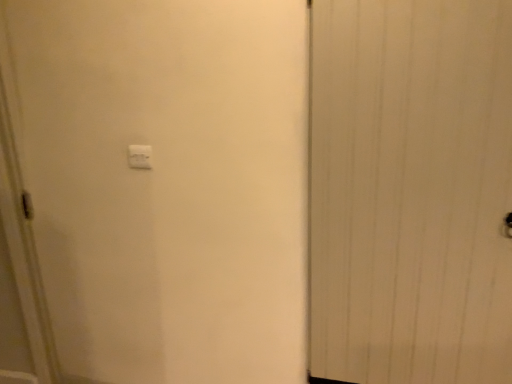
Question: Considering the positions of white plastic light switch at upper center and white wood door at right in the image, is white plastic light switch at upper center taller or shorter than white wood door at right?

Choices:
 (A) tall
 (B) short

Answer: (B)

Question: From the image's perspective, is white plastic light switch at upper center positioned above or below white wood door at right?

Choices:
 (A) below
 (B) above

Answer: (B)

Question: Considering the positions of white plastic light switch at upper center and white wood door at right in the image, is white plastic light switch at upper center bigger or smaller than white wood door at right?

Choices:
 (A) small
 (B) big

Answer: (A)

Question: Considering the positions of white wood door at right and white plastic light switch at upper center in the image, is white wood door at right wider or thinner than white plastic light switch at upper center?

Choices:
 (A) thin
 (B) wide

Answer: (B)

Question: Is white wood door at right taller or shorter than white plastic light switch at upper center?

Choices:
 (A) short
 (B) tall

Answer: (B)

Question: Is white wood door at right in front of or behind white plastic light switch at upper center in the image?

Choices:
 (A) behind
 (B) front

Answer: (B)

Question: Is white wood door at right inside the boundaries of white plastic light switch at upper center, or outside?

Choices:
 (A) outside
 (B) inside

Answer: (A)